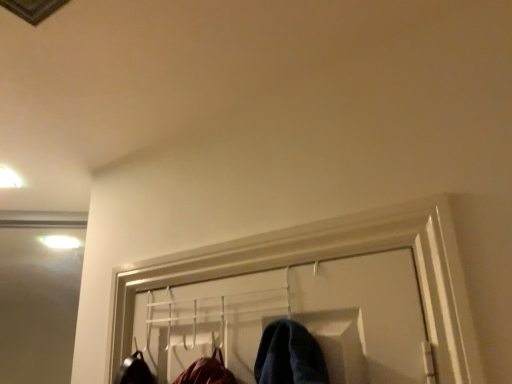
What do you see at coordinates (294, 318) in the screenshot? The image size is (512, 384). I see `metallic silver hooks at center` at bounding box center [294, 318].

Where is `metallic silver hooks at center`? The height and width of the screenshot is (384, 512). metallic silver hooks at center is located at coordinates (294, 318).

Where is `metallic silver hooks at center`? metallic silver hooks at center is located at coordinates (294, 318).